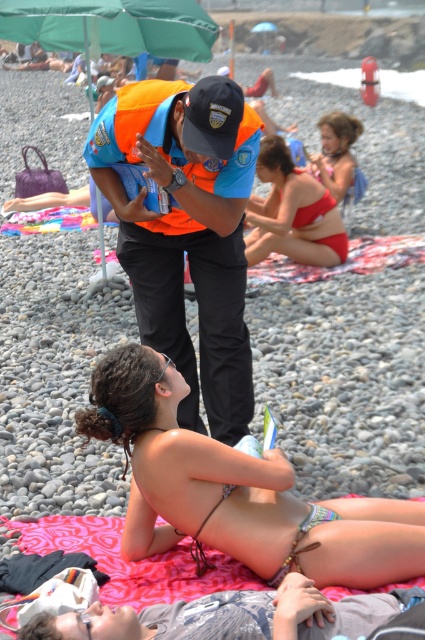
Does green fabric umbrella at upper center have a greater width compared to pink fabric blanket at lower center?

Yes.

Is green fabric umbrella at upper center thinner than pink fabric blanket at lower center?

No.

Which is in front, point (176, 42) or point (105, 545)?

Positioned in front is point (105, 545).

The height and width of the screenshot is (640, 425). In order to click on green fabric umbrella at upper center in this screenshot , I will do pyautogui.click(x=112, y=26).

Does orange uniform at center have a greater height compared to matte red bikini at upper right?

Correct, orange uniform at center is much taller as matte red bikini at upper right.

Can you confirm if orange uniform at center is smaller than matte red bikini at upper right?

No.

The height and width of the screenshot is (640, 425). Find the location of `orange uniform at center`. orange uniform at center is located at coordinates (187, 230).

Does multicolored bikini at center come in front of gray cotton shirt at lower center?

That is False.

Can you confirm if multicolored bikini at center is shorter than gray cotton shirt at lower center?

Incorrect, multicolored bikini at center's height does not fall short of gray cotton shirt at lower center's.

Is point (422, 545) behind point (265, 611)?

Yes, it is.

Locate an element on the screen. multicolored bikini at center is located at coordinates (235, 490).